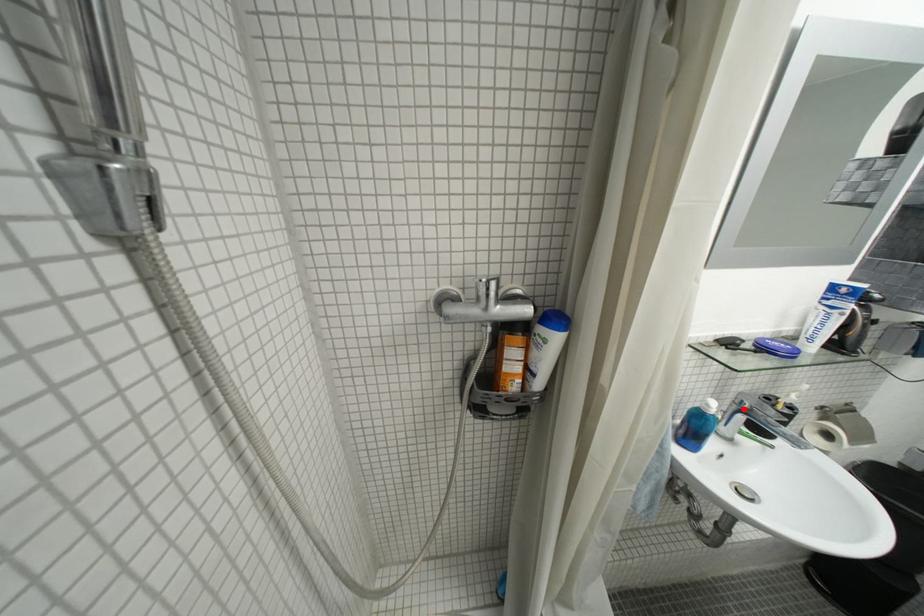
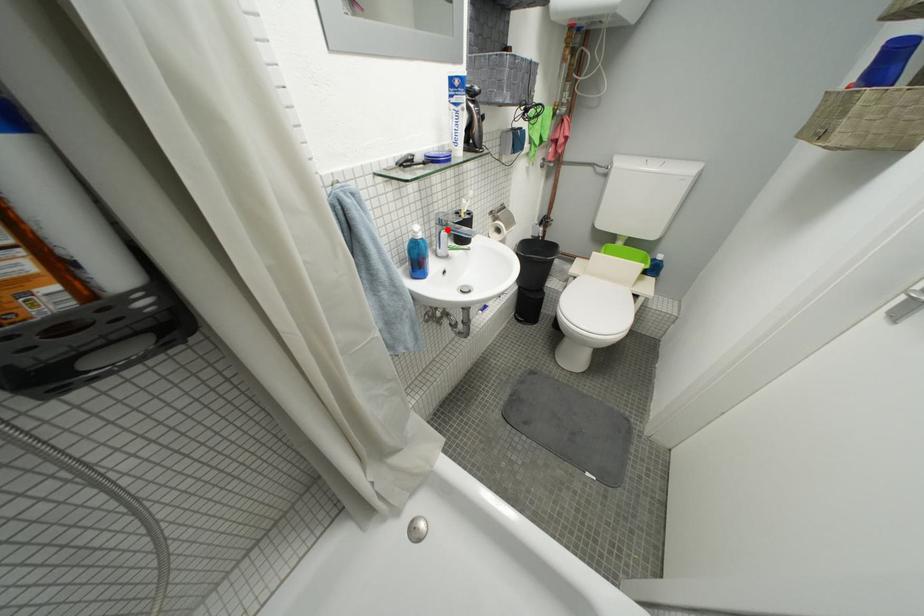
I am providing you with two images of the same scene from different viewpoints. A red point is marked on the first image and another point is marked on the second image. Is the marked point in image1 the same physical position as the marked point in image2?

Yes